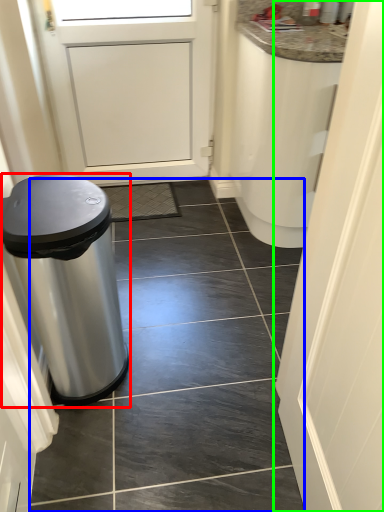
Question: Which object is positioned farthest from waste container (highlighted by a red box)? Select from tile (highlighted by a blue box) and door (highlighted by a green box).

Choices:
 (A) tile
 (B) door

Answer: (B)